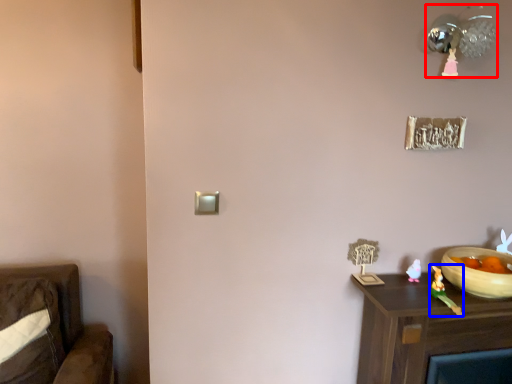
Question: Among these objects, which one is nearest to the camera, light fixture (highlighted by a red box) or toy (highlighted by a blue box)?

Choices:
 (A) light fixture
 (B) toy

Answer: (A)